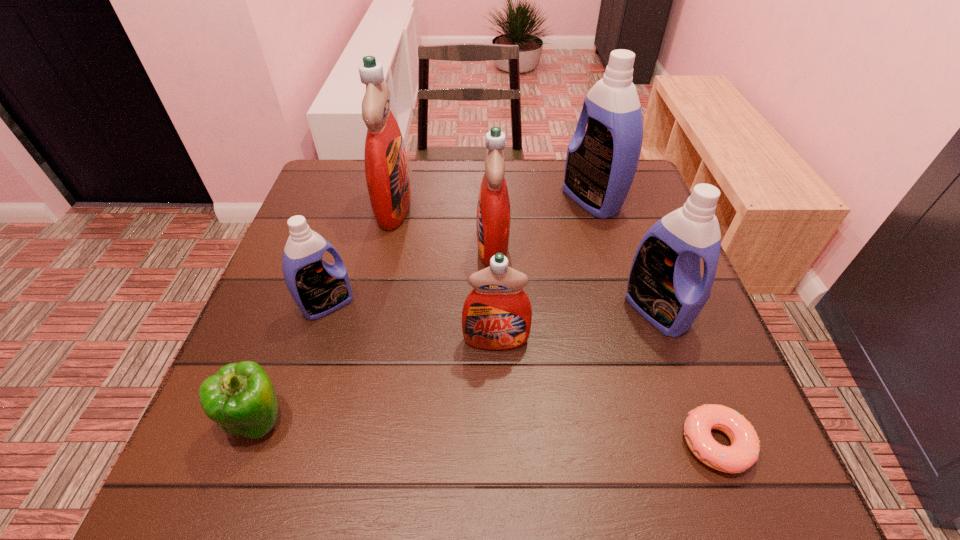
The height and width of the screenshot is (540, 960). I want to click on free spot located 0.230m on the front surface of the biggest red detergent, so click(x=500, y=207).

Image resolution: width=960 pixels, height=540 pixels. I want to click on vacant space located on the front of the biggest blue detergent, so click(603, 238).

Find the location of `blank space located on the front surface of the second smallest red detergent`. blank space located on the front surface of the second smallest red detergent is located at coordinates (380, 246).

Image resolution: width=960 pixels, height=540 pixels. In order to click on free spot located on the front surface of the second smallest red detergent in this screenshot , I will do `click(409, 246)`.

This screenshot has height=540, width=960. I want to click on free space located 0.220m on the front surface of the second smallest red detergent, so click(384, 246).

Where is `free space located on the left of the second smallest blue detergent`? free space located on the left of the second smallest blue detergent is located at coordinates (548, 310).

Locate an element on the screen. This screenshot has height=540, width=960. free point located 0.050m on the left of the smallest blue detergent is located at coordinates (277, 305).

At what (x,y) coordinates should I click in order to perform the action: click on vacant space located 0.210m on the front surface of the smallest red detergent. Please return your answer as a coordinate pair (x, y). This screenshot has height=540, width=960. Looking at the image, I should click on (500, 464).

At what (x,y) coordinates should I click in order to perform the action: click on free space located on the right of the bell pepper. Please return your answer as a coordinate pair (x, y). This screenshot has width=960, height=540. Looking at the image, I should click on (342, 418).

At what (x,y) coordinates should I click in order to perform the action: click on free space located 0.270m on the back of the pink doughnut. Please return your answer as a coordinate pair (x, y). Looking at the image, I should click on (659, 294).